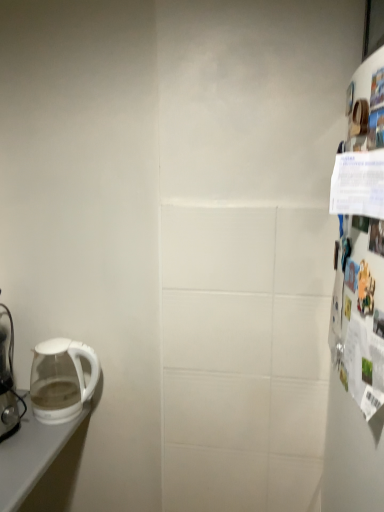
Question: From the image's perspective, would you say transparent glass kettle at left is shown under white glossy coffee maker at left?

Choices:
 (A) no
 (B) yes

Answer: (B)

Question: Would you say transparent glass kettle at left is a long distance from white glossy coffee maker at left?

Choices:
 (A) yes
 (B) no

Answer: (B)

Question: Is transparent glass kettle at left closer to camera compared to white glossy coffee maker at left?

Choices:
 (A) no
 (B) yes

Answer: (A)

Question: Is transparent glass kettle at left facing away from white glossy coffee maker at left?

Choices:
 (A) yes
 (B) no

Answer: (B)

Question: Can you confirm if transparent glass kettle at left is bigger than white glossy coffee maker at left?

Choices:
 (A) no
 (B) yes

Answer: (A)

Question: Can you confirm if transparent glass kettle at left is thinner than white glossy coffee maker at left?

Choices:
 (A) no
 (B) yes

Answer: (A)

Question: Considering the relative sizes of white glossy coffee maker at left and transparent glass kettle at left in the image provided, is white glossy coffee maker at left shorter than transparent glass kettle at left?

Choices:
 (A) no
 (B) yes

Answer: (A)

Question: Is transparent glass kettle at left at the back of white glossy coffee maker at left?

Choices:
 (A) yes
 (B) no

Answer: (B)

Question: From a real-world perspective, is white glossy coffee maker at left positioned under transparent glass kettle at left based on gravity?

Choices:
 (A) no
 (B) yes

Answer: (A)

Question: From the image's perspective, is white glossy coffee maker at left over transparent glass kettle at left?

Choices:
 (A) no
 (B) yes

Answer: (B)

Question: Considering the relative positions of white glossy coffee maker at left and transparent glass kettle at left in the image provided, is white glossy coffee maker at left to the left of transparent glass kettle at left from the viewer's perspective?

Choices:
 (A) yes
 (B) no

Answer: (A)

Question: Can you confirm if white glossy coffee maker at left is taller than transparent glass kettle at left?

Choices:
 (A) no
 (B) yes

Answer: (B)

Question: From their relative heights in the image, would you say transparent glass kettle at left is taller or shorter than white glossy coffee maker at left?

Choices:
 (A) short
 (B) tall

Answer: (A)